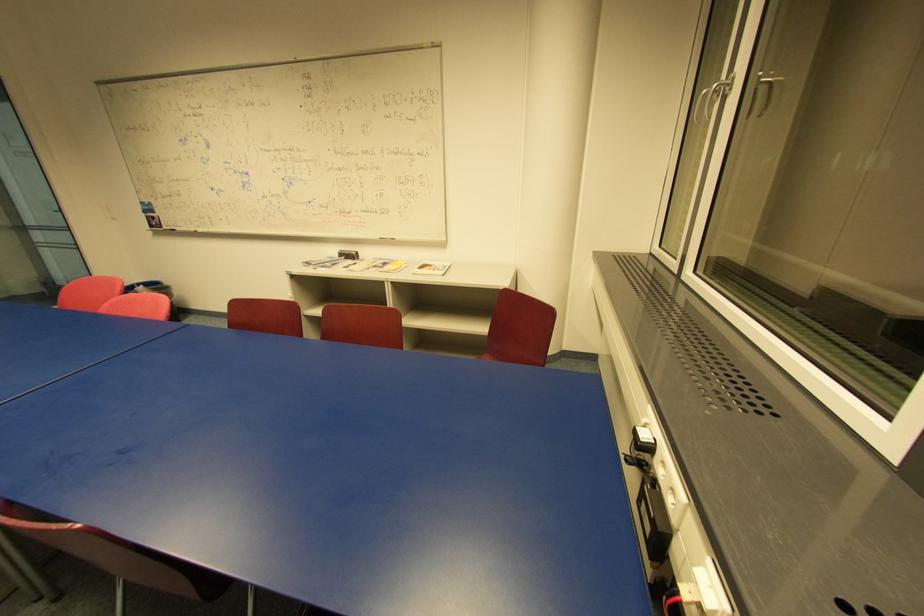
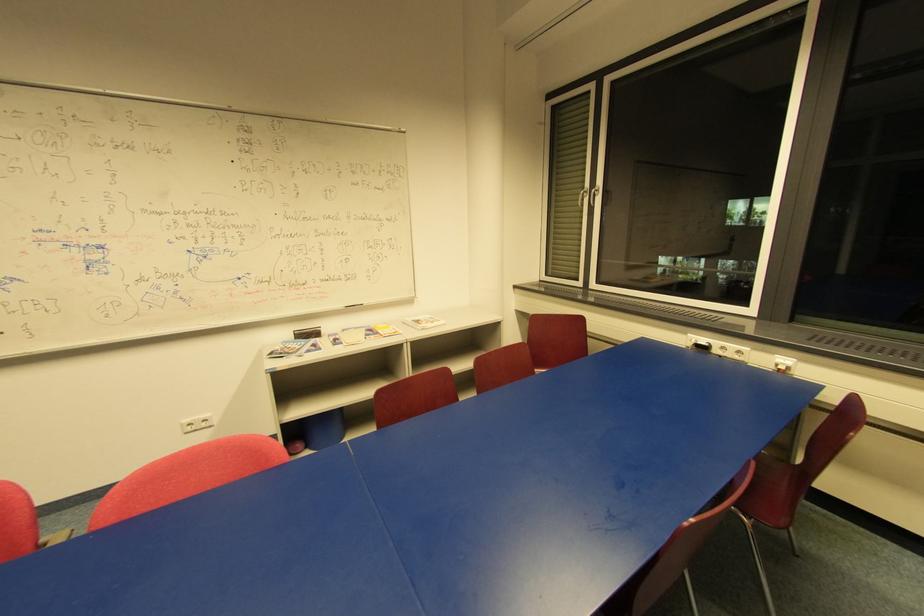
In the second image, find the point that corresponds to pixel 354 254 in the first image.

(319, 331)